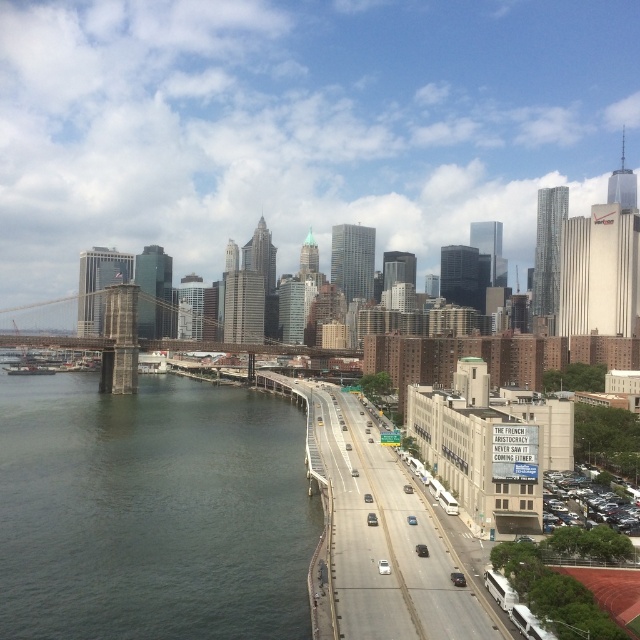
You are standing at the observation deck of the Empire State Building and see two points in the city below. The first point is located at coordinates point (61, 422) and the second point is at point (163, 340). Which point is closer to you?

Point (61, 422) is closer to the camera than point (163, 340).